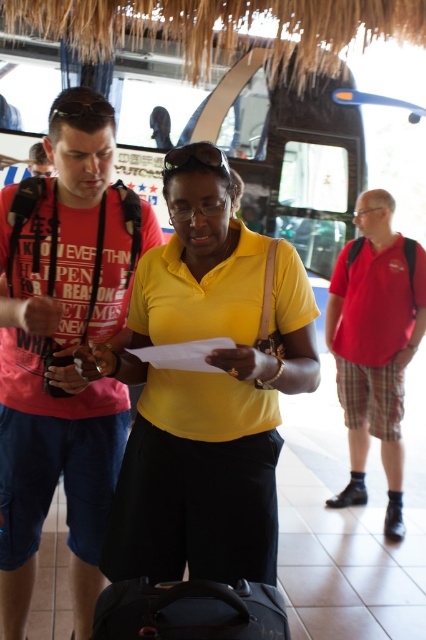
What is the location of the point with coordinates (63, 348) in the image?

The point with coordinates (63, 348) is located on the matte red tshirt at left.

You are a traveler at the bus terminal and see the yellow matte shirt at center and the black leather suitcase at lower center. Which object is positioned to the right of the other?

The yellow matte shirt at center is to the right of the black leather suitcase at lower center.